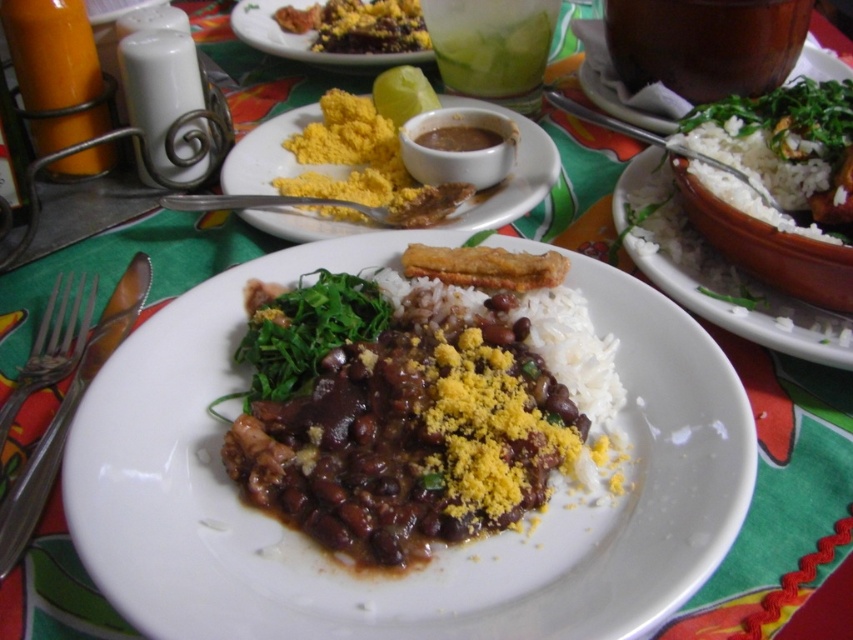
Is white ceramic bowl at upper right smaller than matte orange glass at upper left?

Actually, white ceramic bowl at upper right might be larger than matte orange glass at upper left.

Who is positioned more to the right, white ceramic bowl at upper right or matte orange glass at upper left?

white ceramic bowl at upper right

Is point (614, 202) farther from camera compared to point (88, 76)?

No, (614, 202) is closer to viewer.

Locate an element on the screen. The image size is (853, 640). white ceramic bowl at upper right is located at coordinates (715, 273).

Between matte brown beans at center and satin silver fork at lower left, which one is positioned lower?

satin silver fork at lower left

Between point (340, 433) and point (100, 333), which one is positioned behind?

Point (100, 333)

Image resolution: width=853 pixels, height=640 pixels. In order to click on matte brown beans at center in this screenshot , I will do `click(421, 401)`.

Can you confirm if white rice at right is bigger than matte orange glass at upper left?

Correct, white rice at right is larger in size than matte orange glass at upper left.

Find the location of a particular element. This screenshot has width=853, height=640. white rice at right is located at coordinates (776, 150).